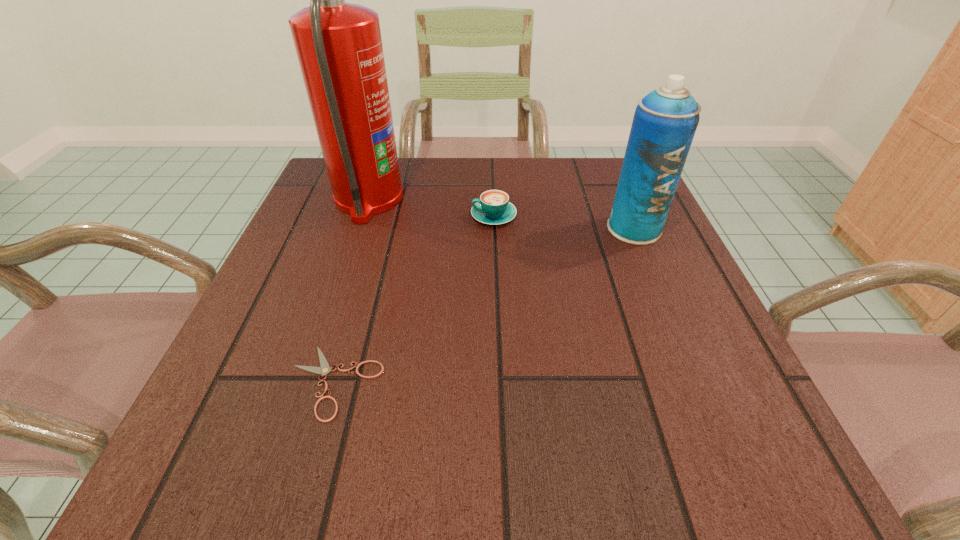
Identify the location of object present at the near left corner. The width and height of the screenshot is (960, 540). [324, 369].

Image resolution: width=960 pixels, height=540 pixels. In order to click on vacant region at the far edge of the desktop in this screenshot , I will do `click(454, 163)`.

Locate an element on the screen. The image size is (960, 540). vacant space at the near edge is located at coordinates (601, 424).

In the image, there is a desktop. Identify the location of vacant space at the left edge. The image size is (960, 540). (318, 292).

What are the coordinates of `free space at the right edge of the desktop` in the screenshot? It's located at (674, 265).

Locate an element on the screen. free space at the far left corner is located at coordinates (321, 181).

Locate an element on the screen. The height and width of the screenshot is (540, 960). free region at the far right corner of the desktop is located at coordinates (605, 190).

Find the location of `empty space between the tallest object and the cappuccino`. empty space between the tallest object and the cappuccino is located at coordinates (431, 208).

Where is `free point between the second shortest object and the third shortest object`? The height and width of the screenshot is (540, 960). free point between the second shortest object and the third shortest object is located at coordinates (564, 222).

Locate an element on the screen. The image size is (960, 540). vacant region between the rightmost object and the shortest object is located at coordinates (485, 306).